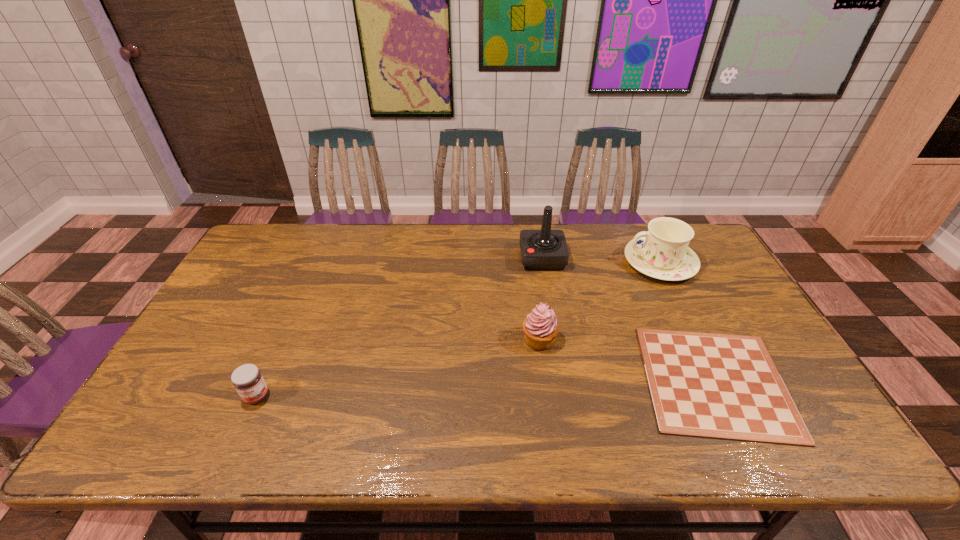
The width and height of the screenshot is (960, 540). What are the coordinates of `joystick` in the screenshot? It's located at (545, 249).

I want to click on chinaware, so click(662, 252).

I want to click on cupcake, so click(x=540, y=327).

The height and width of the screenshot is (540, 960). What are the coordinates of `the leftmost object` in the screenshot? It's located at (247, 379).

Locate an element on the screen. the second shortest object is located at coordinates coord(247,379).

This screenshot has width=960, height=540. I want to click on checkerboard, so click(719, 386).

I want to click on vacant area situated on the front-facing side of the tallest object, so click(x=461, y=258).

Where is `free space located on the front-facing side of the tallest object`? free space located on the front-facing side of the tallest object is located at coordinates (499, 258).

At what (x,y) coordinates should I click in order to perform the action: click on free space located 0.240m on the front-facing side of the tallest object. Please return your answer as a coordinate pair (x, y). The image size is (960, 540). Looking at the image, I should click on (449, 258).

This screenshot has height=540, width=960. I want to click on vacant position located 0.340m on the handle side of the chinaware, so click(522, 262).